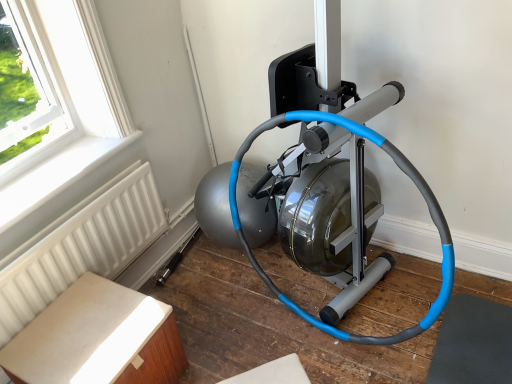
Question: Is white plastic radiator at lower left at the right side of white textured radiator at lower left?

Choices:
 (A) no
 (B) yes

Answer: (A)

Question: Considering the relative sizes of white plastic radiator at lower left and white textured radiator at lower left in the image provided, is white plastic radiator at lower left shorter than white textured radiator at lower left?

Choices:
 (A) no
 (B) yes

Answer: (B)

Question: From a real-world perspective, is white plastic radiator at lower left positioned over white textured radiator at lower left based on gravity?

Choices:
 (A) no
 (B) yes

Answer: (B)

Question: Is white plastic radiator at lower left not within white textured radiator at lower left?

Choices:
 (A) yes
 (B) no

Answer: (A)

Question: Is white plastic radiator at lower left at the left side of white textured radiator at lower left?

Choices:
 (A) yes
 (B) no

Answer: (A)

Question: Looking at the image, does white plastic radiator at lower left seem bigger or smaller compared to light brown wood table at lower left?

Choices:
 (A) big
 (B) small

Answer: (B)

Question: From a real-world perspective, relative to light brown wood table at lower left, is white plastic radiator at lower left vertically above or below?

Choices:
 (A) below
 (B) above

Answer: (B)

Question: Is white plastic radiator at lower left situated inside light brown wood table at lower left or outside?

Choices:
 (A) outside
 (B) inside

Answer: (A)

Question: From the image's perspective, is white plastic radiator at lower left above or below light brown wood table at lower left?

Choices:
 (A) above
 (B) below

Answer: (A)

Question: Choose the correct answer: Is white plastic radiator at lower left inside blue rubber garden hose at center or outside it?

Choices:
 (A) outside
 (B) inside

Answer: (A)

Question: Considering the positions of point (17, 216) and point (260, 127), is point (17, 216) closer or farther from the camera than point (260, 127)?

Choices:
 (A) closer
 (B) farther

Answer: (A)

Question: Is white plastic radiator at lower left bigger or smaller than blue rubber garden hose at center?

Choices:
 (A) small
 (B) big

Answer: (A)

Question: Is white plastic radiator at lower left taller or shorter than blue rubber garden hose at center?

Choices:
 (A) tall
 (B) short

Answer: (B)

Question: In terms of height, does light brown wood table at lower left look taller or shorter compared to white textured radiator at lower left?

Choices:
 (A) tall
 (B) short

Answer: (B)

Question: Is light brown wood table at lower left bigger or smaller than white textured radiator at lower left?

Choices:
 (A) small
 (B) big

Answer: (B)